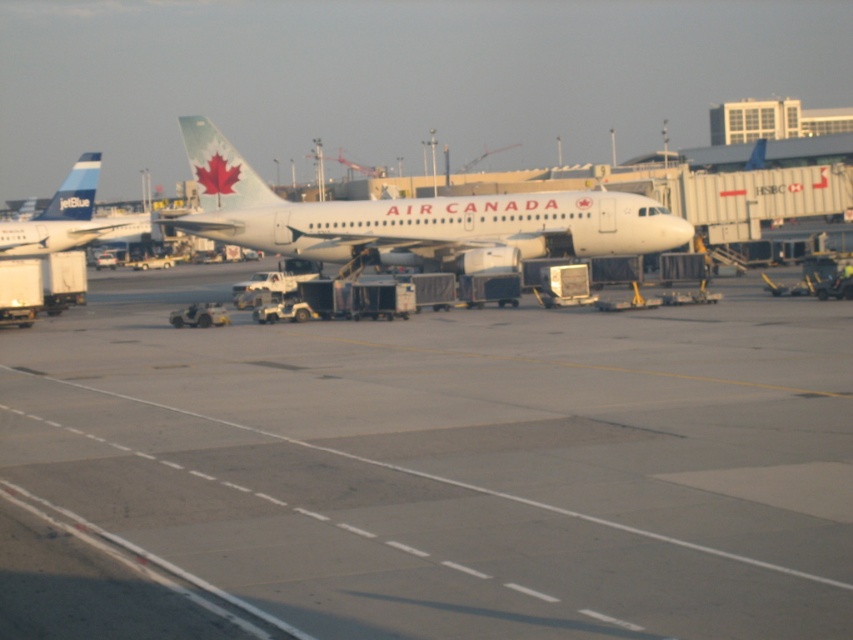
Does white matte airplane at center have a greater height compared to matte blue airplane at left?

Yes.

Is white matte airplane at center in front of matte blue airplane at left?

That is True.

Identify the location of white matte airplane at center. (415, 218).

Is the position of gray concrete tarmac at center more distant than that of matte blue airplane at left?

That is False.

Can you confirm if gray concrete tarmac at center is smaller than matte blue airplane at left?

Yes.

Between point (44, 561) and point (61, 243), which one is positioned behind?

Point (61, 243)

You are a GUI agent. You are given a task and a screenshot of the screen. Output one action in this format:
    pyautogui.click(x=<x>, y=<y>)
    Task: Click on the gray concrete tarmac at center
    Image resolution: width=853 pixels, height=640 pixels.
    Given the screenshot: What is the action you would take?
    427,470

Based on the photo, is gray concrete tarmac at center to the left of white matte airplane at center from the viewer's perspective?

In fact, gray concrete tarmac at center is to the right of white matte airplane at center.

Between point (231, 456) and point (553, 211), which one is positioned in front?

Positioned in front is point (231, 456).

This screenshot has width=853, height=640. Identify the location of gray concrete tarmac at center. (427, 470).